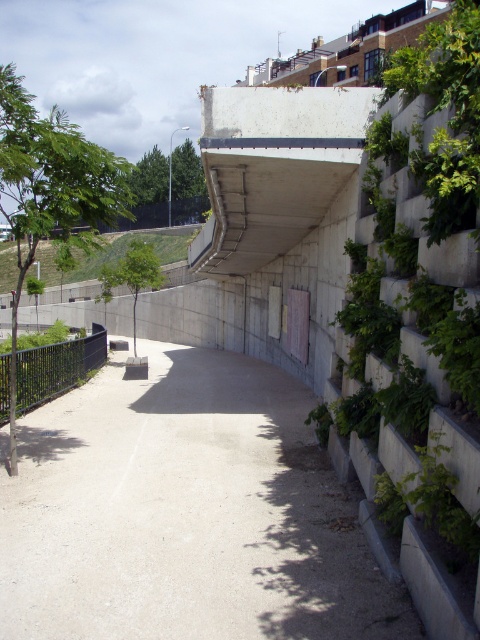
You are a delivery person with a cart that is 1.2 meters wide. You need to navigate through the gray concrete path at center while avoiding the green leafy tree at left. Can your cart fit through the path without hitting the tree?

The gray concrete path at center has a lesser width compared to green leafy tree at left. Since the path is narrower than the tree, it might be too narrow for the cart. However, the description only compares their widths relative to each other, not their absolute sizes. Without specific measurements, it is unclear if the path is wide enough for the cart.

You are standing on the pedestrian pathway and want to reach the point marked at coordinates [296,442]. Given that the pathway is 10 meters wide, can you safely walk to that point without crossing the black metal fence on the left or the sloping concrete wall on the right?

The point marked at coordinates [296,442] is 9.45 meters away from the viewer. Since the pathway is 10 meters wide, you can safely walk to that point without crossing the black metal fence on the left or the sloping concrete wall on the right.

You are a delivery person standing on the gray concrete path at center. You need to deliver a package to the address located behind the green leafy tree at center. Can you walk straight ahead along the path to reach the destination?

The gray concrete path at center is in front of green leafy tree at center, so you can walk straight ahead along the path to reach the destination behind the green leafy tree at center.